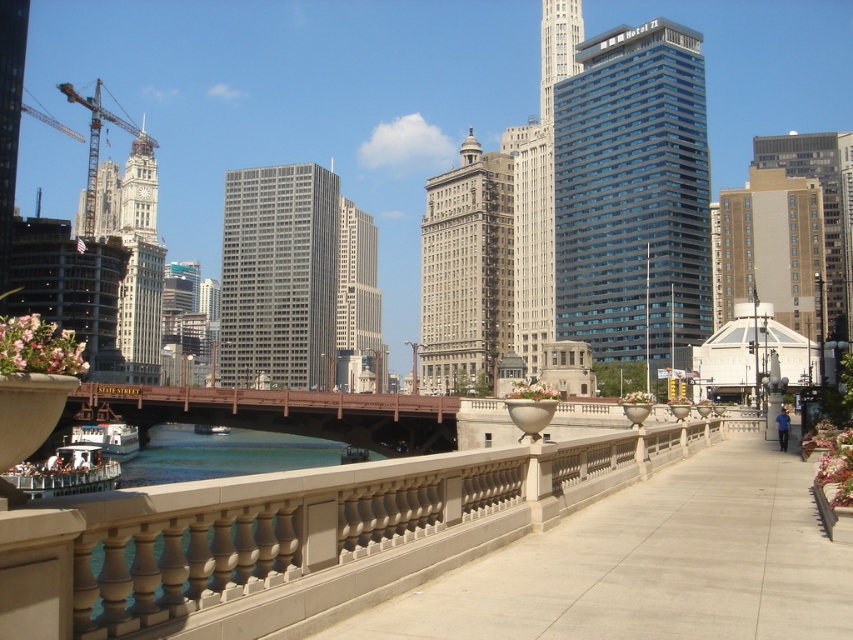
Question: Which point appears farthest from the camera in this image?

Choices:
 (A) (340, 228)
 (B) (450, 276)
 (C) (228, 364)

Answer: (A)

Question: Is the position of beige stone building at center less distant than that of silver glass skyscraper at center?

Choices:
 (A) yes
 (B) no

Answer: (A)

Question: Which of the following is the farthest from the observer?

Choices:
 (A) beige stone railing at lower center
 (B) silver glass skyscraper at center
 (C) brown wooden bridge at center

Answer: (B)

Question: Which point appears closest to the camera in this image?

Choices:
 (A) [x=451, y=384]
 (B) [x=550, y=13]
 (C) [x=79, y=102]
 (D) [x=651, y=612]

Answer: (D)

Question: Can you confirm if beige stone railing at lower center is bigger than silver glass skyscraper at center?

Choices:
 (A) no
 (B) yes

Answer: (A)

Question: Is smooth concrete pavement at center to the left of metallic construction crane at upper left from the viewer's perspective?

Choices:
 (A) yes
 (B) no

Answer: (B)